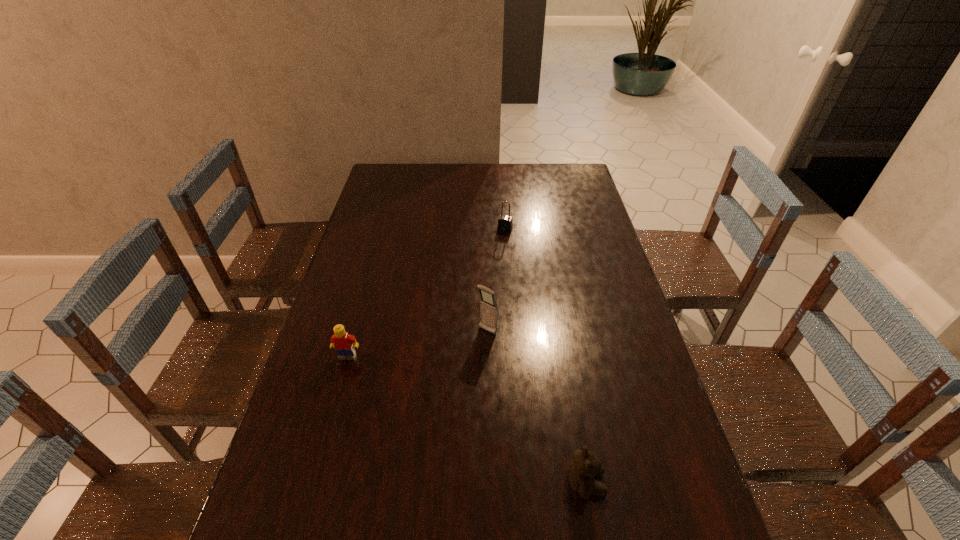
The height and width of the screenshot is (540, 960). I want to click on vacant space situated 0.400m on the shackle of the second object from right to left, so click(471, 307).

At what (x,y) coordinates should I click in order to perform the action: click on free region located on the shackle of the second object from right to left. Please return your answer as a coordinate pair (x, y). Looking at the image, I should click on (482, 281).

Locate an element on the screen. The height and width of the screenshot is (540, 960). vacant area situated on the shackle of the second object from right to left is located at coordinates (497, 245).

The image size is (960, 540). Find the location of `free region located on the front-facing side of the third nearest object`. free region located on the front-facing side of the third nearest object is located at coordinates (432, 395).

I want to click on vacant space located 0.210m on the front-facing side of the third nearest object, so click(437, 389).

Identify the location of vacant position located on the front-facing side of the third nearest object. This screenshot has height=540, width=960. (392, 442).

Identify the location of object positioned at the near edge. (585, 468).

I want to click on object located at the left edge, so click(x=344, y=343).

The width and height of the screenshot is (960, 540). In order to click on free region at the far edge of the desktop in this screenshot , I will do `click(460, 191)`.

In the image, there is a desktop. At what (x,y) coordinates should I click in order to perform the action: click on vacant space at the left edge. Please return your answer as a coordinate pair (x, y). Image resolution: width=960 pixels, height=540 pixels. Looking at the image, I should click on (362, 309).